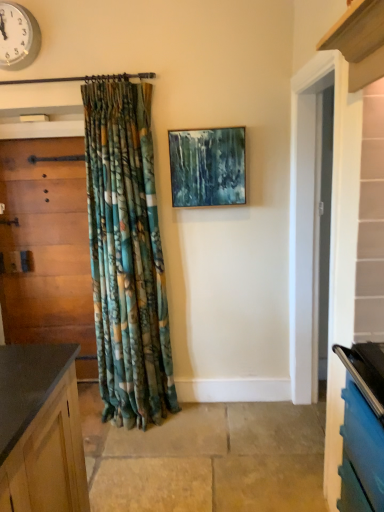
The image size is (384, 512). Find the location of `free point above wooden door at left (from a real-world perspective)`. free point above wooden door at left (from a real-world perspective) is located at coordinates (34, 140).